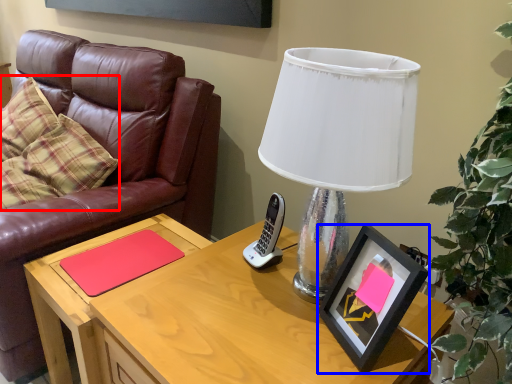
Question: Which object appears farthest to the camera in this image, pillow (highlighted by a red box) or picture frame (highlighted by a blue box)?

Choices:
 (A) pillow
 (B) picture frame

Answer: (A)